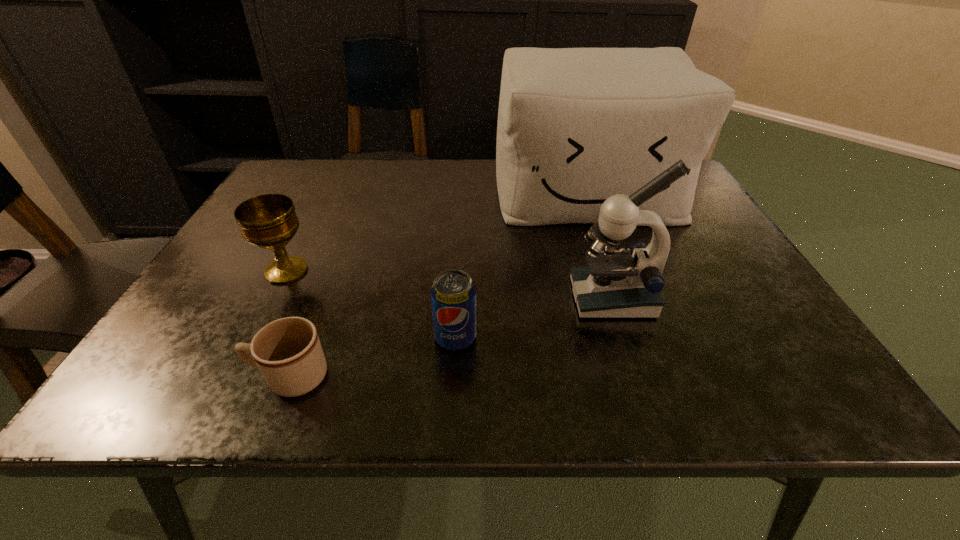
I want to click on vacant space located 0.380m at the eyepiece of the fourth shortest object, so click(x=386, y=298).

I want to click on blank area located at the eyepiece of the fourth shortest object, so (x=485, y=298).

Image resolution: width=960 pixels, height=540 pixels. Find the location of `vacant space located 0.110m on the back of the chalice`. vacant space located 0.110m on the back of the chalice is located at coordinates (309, 227).

At what (x,y) coordinates should I click in order to perform the action: click on blank space located 0.240m on the back of the second nearest object. Please return your answer as a coordinate pair (x, y). Looking at the image, I should click on (461, 246).

At what (x,y) coordinates should I click in order to perform the action: click on vacant space located 0.110m on the side of the mug with the handle. Please return your answer as a coordinate pair (x, y). This screenshot has height=540, width=960. Looking at the image, I should click on (187, 377).

Find the location of `vacant space located on the side of the mug with the handle`. vacant space located on the side of the mug with the handle is located at coordinates (152, 377).

Image resolution: width=960 pixels, height=540 pixels. I want to click on free location located on the side of the mug with the handle, so click(181, 377).

What are the coordinates of `object present at the far edge` in the screenshot? It's located at (576, 126).

This screenshot has height=540, width=960. In order to click on object positioned at the near edge in this screenshot , I will do `click(288, 352)`.

Locate an element on the screen. The image size is (960, 540). object situated at the left edge is located at coordinates (269, 221).